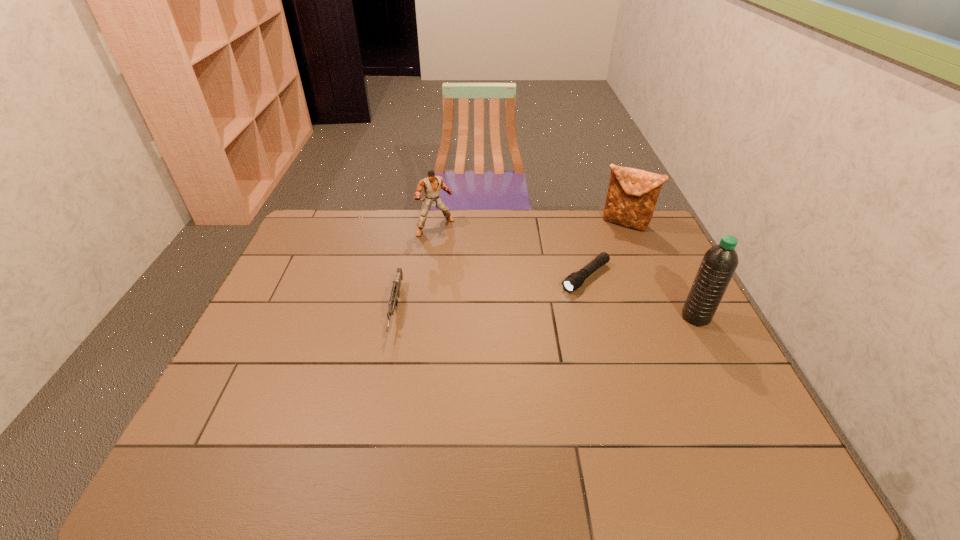
Locate an element on the screen. free point between the puncher and the clutch bag is located at coordinates (531, 225).

You are a GUI agent. You are given a task and a screenshot of the screen. Output one action in this format:
    pyautogui.click(x=<x>, y=<y>)
    Task: Click on the free point between the fourth tallest object and the tallest object
    The image size is (960, 540).
    Given the screenshot: What is the action you would take?
    pyautogui.click(x=546, y=313)

This screenshot has height=540, width=960. Find the location of `unoccupied position between the puncher and the clutch bag`. unoccupied position between the puncher and the clutch bag is located at coordinates (531, 225).

Identify the location of unoccupied area between the clutch bag and the second object from left to right. The width and height of the screenshot is (960, 540). pos(531,225).

In order to click on unoccupied position between the third object from right to left and the puncher in this screenshot , I will do `click(511, 252)`.

Find the location of a particular element. empty space between the puncher and the gun is located at coordinates (416, 268).

Find the location of a particular element. The image size is (960, 540). free space between the leftmost object and the clutch bag is located at coordinates (511, 266).

The image size is (960, 540). I want to click on the second closest object to the fourth tallest object, so click(x=575, y=280).

This screenshot has height=540, width=960. I want to click on object that is the second closest one to the shortest object, so click(719, 263).

In order to click on free space that satisfies the following two spatial constraints: 1. on the front side of the tallest object; 2. on the right side of the clutch bag in this screenshot , I will do `click(666, 317)`.